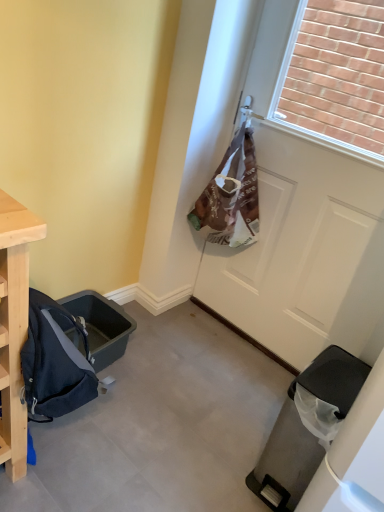
Find the location of a particular element. The width and height of the screenshot is (384, 512). vacant region to the left of black plastic trash can at lower right is located at coordinates (218, 451).